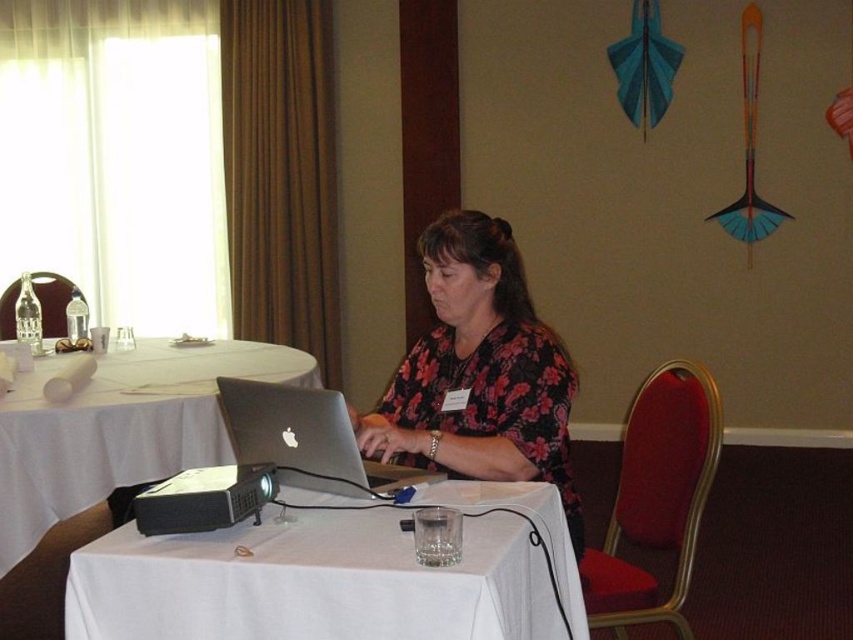
Which is more to the right, floral fabric shirt at center or white cloth table at center?

Positioned to the right is floral fabric shirt at center.

Can you confirm if floral fabric shirt at center is taller than white cloth table at center?

Indeed, floral fabric shirt at center has a greater height compared to white cloth table at center.

You are a GUI agent. You are given a task and a screenshot of the screen. Output one action in this format:
    pyautogui.click(x=<x>, y=<y>)
    Task: Click on the floral fabric shirt at center
    
    Given the screenshot: What is the action you would take?
    pyautogui.click(x=479, y=371)

At what (x,y) coordinates should I click in order to perform the action: click on floral fabric shirt at center. Please return your answer as a coordinate pair (x, y). The image size is (853, 640). Looking at the image, I should click on (479, 371).

Based on the photo, is white cloth table at center above silver metallic laptop at center?

No, white cloth table at center is not above silver metallic laptop at center.

The image size is (853, 640). Find the location of `white cloth table at center`. white cloth table at center is located at coordinates (120, 428).

Can you confirm if white cloth-covered table at center is shorter than silver metallic laptop at center?

Incorrect, white cloth-covered table at center's height does not fall short of silver metallic laptop at center's.

In the scene shown: Does white cloth-covered table at center appear over silver metallic laptop at center?

No.

The height and width of the screenshot is (640, 853). Find the location of `white cloth-covered table at center`. white cloth-covered table at center is located at coordinates (312, 582).